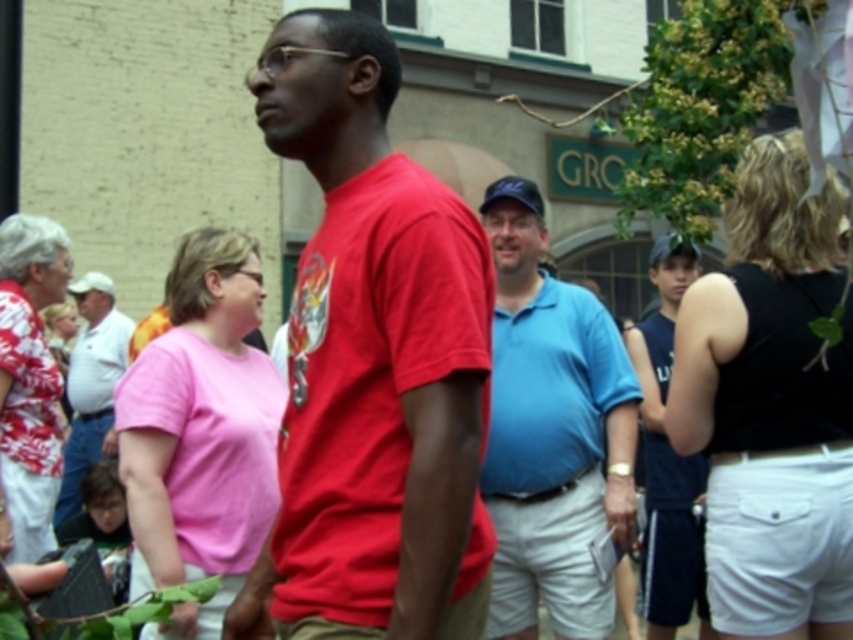
You are organizing a charity event and need to display two banners. One banner is for the pink matte shirt at center and the other for the dark blue jersey at right. If you want to make the banners proportional to the sizes of the shirts, which banner should be larger?

The dark blue jersey at right should have a larger banner since the pink matte shirt at center is smaller than the dark blue jersey at right according to the description.

You are a photographer trying to capture a photo of both the pink matte shirt at center and the dark blue jersey at right. Based on their positions, which direction should you move to frame them both in the shot?

To frame both the pink matte shirt at center and the dark blue jersey at right, you should move to the left since the pink matte shirt at center is positioned to the left of the dark blue jersey at right.